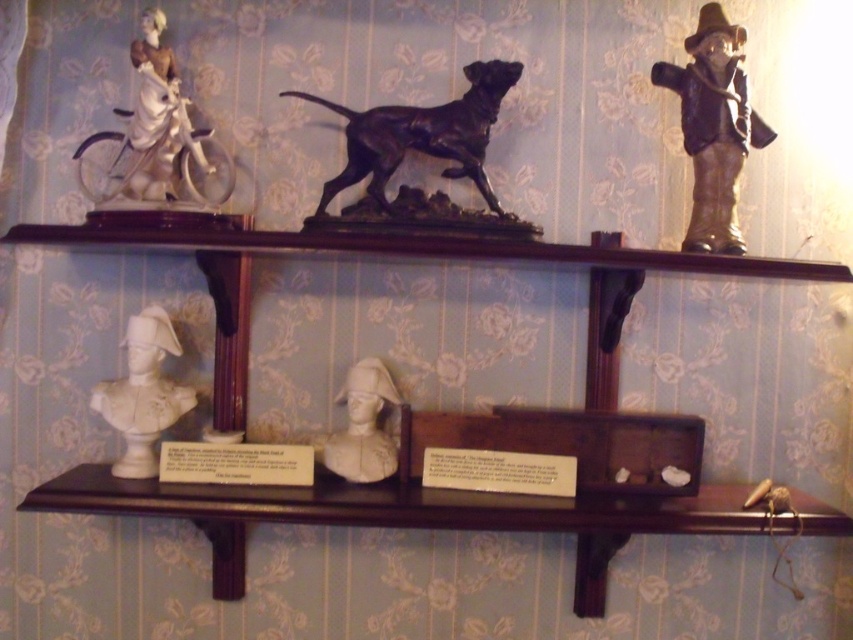
You are an interior designer arranging items on a shelf. You have a bronze figurine at upper right and a white porcelain bust at center. Which of these two items is taller?

The bronze figurine at upper right is much taller than the white porcelain bust at center.

You are arranging a new item on the lower shelf and want to place it between the bronze figurine at upper right and the white porcelain bust at center. Is this possible?

The bronze figurine at upper right is located to the right of the white porcelain bust at center on the upper shelf. Since they are on different shelves, you cannot place an item between them on the lower shelf.

You are an interior designer arranging items on a shelf. You have a shiny black statue at center and a white porcelain bust at center. The shelf is 18 inches wide. Can both items fit side by side without overlapping?

The shiny black statue at center is 12.11 inches from the white porcelain bust at center. Since the shelf is 18 inches wide, the total space required is 12.11 inches, which is less than 18 inches. Therefore, both items can fit side by side without overlapping.